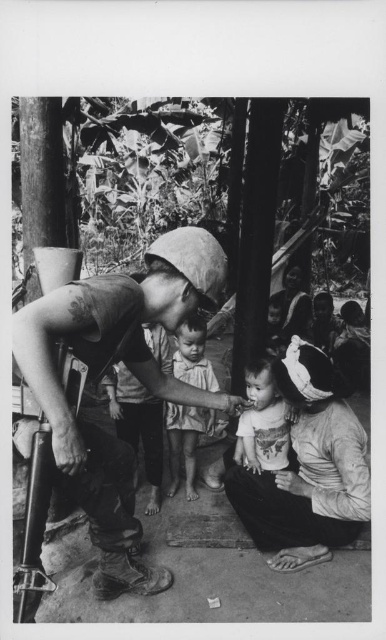
Question: Which of the following is the closest to the observer?

Choices:
 (A) smooth skin child at center
 (B) matte white shirt at lower right

Answer: (B)

Question: Where is matte black helmet at center located in relation to matte white shirt at lower right in the image?

Choices:
 (A) left
 (B) right

Answer: (A)

Question: Which of the following is the closest to the observer?

Choices:
 (A) printed cotton shirt at center
 (B) smooth skin child at center

Answer: (A)

Question: Where is matte white shirt at lower right located in relation to printed cotton shirt at center in the image?

Choices:
 (A) right
 (B) left

Answer: (A)

Question: Is matte black helmet at center bigger than matte white shirt at lower right?

Choices:
 (A) no
 (B) yes

Answer: (B)

Question: Which point appears closest to the camera in this image?

Choices:
 (A) (189, 339)
 (B) (255, 416)
 (C) (91, 474)

Answer: (C)